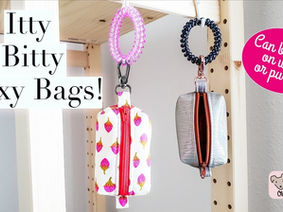
In order to click on white wall in this screenshot , I will do `click(261, 140)`.